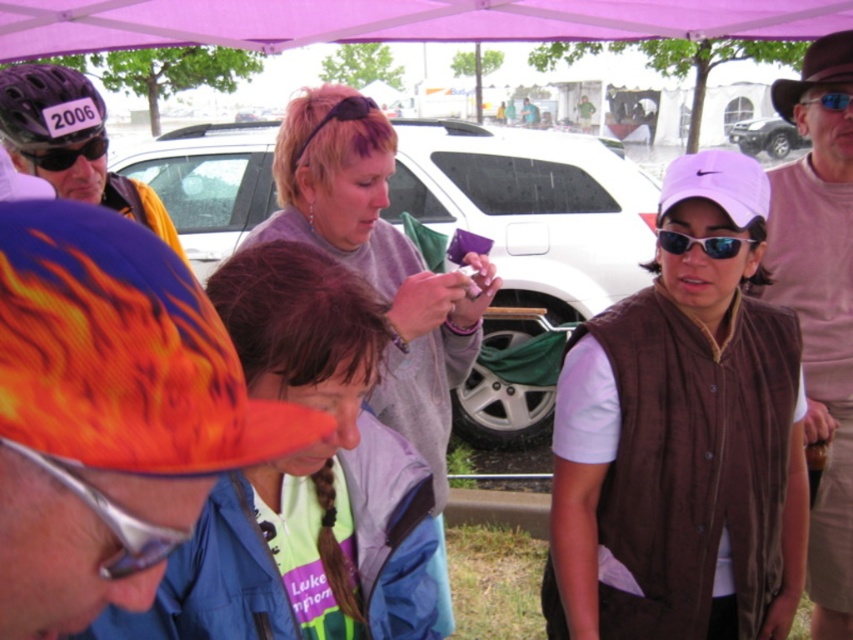
You are a delivery person carrying a package that requires a 2.5 meter clearance to maneuver safely. You need to move from the white matte car at center to the matte black helmet at left. Can you navigate the space between them without hitting anything?

The distance between the white matte car at center and the matte black helmet at left is 2.24 meters, which is less than the required 2.5 meters clearance. Therefore, you cannot safely navigate the space between them without risking a collision.

What object is located at the coordinates point (71, 144) in the image?

The point (71, 144) corresponds to the matte black helmet at left.

You are standing at the edge of the parking lot and see the white matte car at center. If you want to walk directly towards it, which direction should you head?

Since the white matte car at center is located at point (531, 216), you should head towards the center of the parking lot to reach it directly.